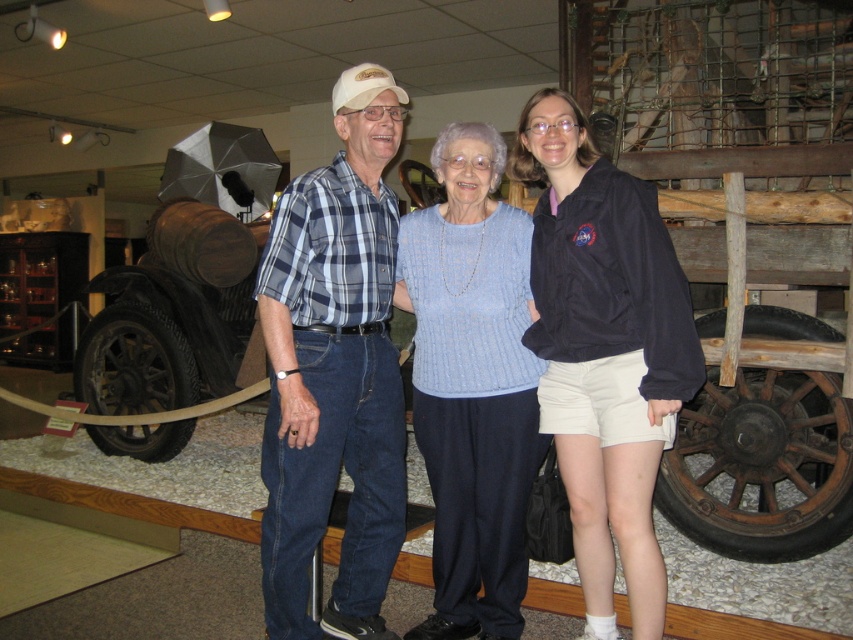
Which of these two, light blue sweater at center or rusty wood wagon at center, stands shorter?

rusty wood wagon at center is shorter.

Find the location of a particular element. The image size is (853, 640). light blue sweater at center is located at coordinates [474, 396].

Where is `light blue sweater at center`? light blue sweater at center is located at coordinates (474, 396).

In the scene shown: Who is lower down, blue plaid shirt at center or black fabric jacket at center?

black fabric jacket at center is lower down.

Who is taller, blue plaid shirt at center or black fabric jacket at center?

blue plaid shirt at center is taller.

Who is more distant from viewer, (375, 625) or (538, 92)?

Positioned behind is point (375, 625).

Identify the location of blue plaid shirt at center. This screenshot has width=853, height=640. (334, 371).

Who is taller, light blue sweater at center or light blue knitted sweater at center?

Standing taller between the two is light blue sweater at center.

Is light blue sweater at center further to camera compared to light blue knitted sweater at center?

No, light blue sweater at center is closer to the viewer.

Does point (535, 358) lie in front of point (494, 339)?

No, it is behind (494, 339).

The width and height of the screenshot is (853, 640). I want to click on light blue sweater at center, so click(x=474, y=396).